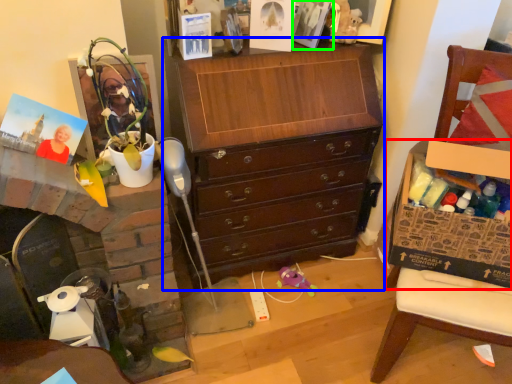
Question: Which object is positioned farthest from cabinetry (highlighted by a red box)? Select from chest of drawers (highlighted by a blue box) and picture frame (highlighted by a green box).

Choices:
 (A) chest of drawers
 (B) picture frame

Answer: (B)